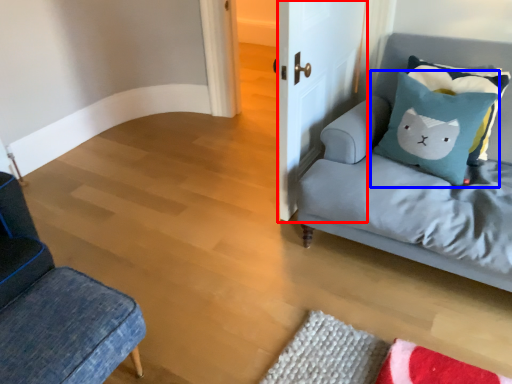
Question: Which point is further to the camera, door (highlighted by a red box) or pillow (highlighted by a blue box)?

Choices:
 (A) door
 (B) pillow

Answer: (B)